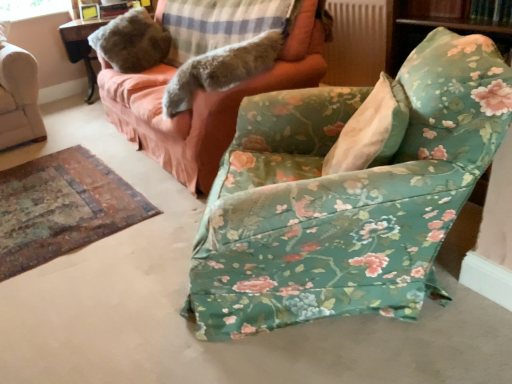
Question: Is the position of floral fabric chair at center more distant than that of clear glass window screen at upper left?

Choices:
 (A) yes
 (B) no

Answer: (B)

Question: Can you confirm if floral fabric chair at center is smaller than clear glass window screen at upper left?

Choices:
 (A) no
 (B) yes

Answer: (A)

Question: Can you confirm if floral fabric chair at center is wider than clear glass window screen at upper left?

Choices:
 (A) no
 (B) yes

Answer: (B)

Question: Can you confirm if floral fabric chair at center is positioned to the right of clear glass window screen at upper left?

Choices:
 (A) no
 (B) yes

Answer: (B)

Question: Is floral fabric chair at center far away from clear glass window screen at upper left?

Choices:
 (A) yes
 (B) no

Answer: (A)

Question: From the image's perspective, is floral fabric chair at center under clear glass window screen at upper left?

Choices:
 (A) yes
 (B) no

Answer: (A)

Question: Is fluffy gray fur at upper center smaller than clear glass window screen at upper left?

Choices:
 (A) yes
 (B) no

Answer: (B)

Question: Could clear glass window screen at upper left be considered to be inside fluffy gray fur at upper center?

Choices:
 (A) no
 (B) yes

Answer: (A)

Question: Is fluffy gray fur at upper center positioned far away from clear glass window screen at upper left?

Choices:
 (A) no
 (B) yes

Answer: (B)

Question: Does fluffy gray fur at upper center have a lesser width compared to clear glass window screen at upper left?

Choices:
 (A) no
 (B) yes

Answer: (A)

Question: Is fluffy gray fur at upper center turned away from clear glass window screen at upper left?

Choices:
 (A) no
 (B) yes

Answer: (A)

Question: From a real-world perspective, is fluffy gray fur at upper center under clear glass window screen at upper left?

Choices:
 (A) no
 (B) yes

Answer: (B)

Question: Is floral fabric couch at upper center aimed at clear glass window screen at upper left?

Choices:
 (A) yes
 (B) no

Answer: (B)